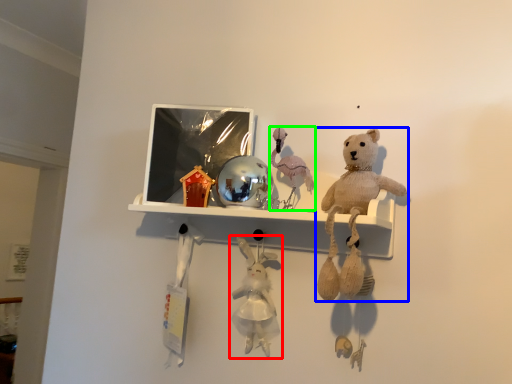
Question: Estimate the real-world distances between objects in this image. Which object is closer to toy (highlighted by a red box), teddy bear (highlighted by a blue box) or toy (highlighted by a green box)?

Choices:
 (A) teddy bear
 (B) toy

Answer: (B)